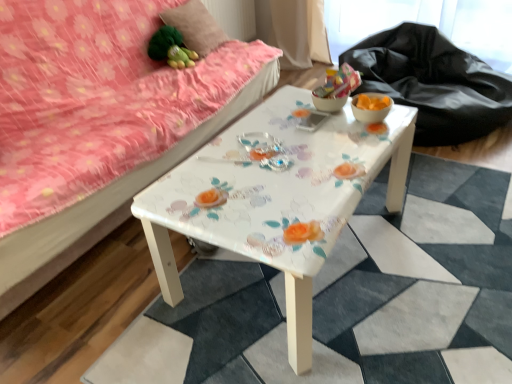
Question: Is matte orange glass bowl at right, which is the 1th glass bowl from right to left, completely or partially outside of fluffy pink pillow at upper left?

Choices:
 (A) no
 (B) yes

Answer: (B)

Question: From a real-world perspective, is matte orange glass bowl at right, the second glass bowl viewed from the left, below fluffy pink pillow at upper left?

Choices:
 (A) yes
 (B) no

Answer: (A)

Question: Is matte orange glass bowl at right, the second glass bowl viewed from the left, bigger than fluffy pink pillow at upper left?

Choices:
 (A) yes
 (B) no

Answer: (B)

Question: Does matte orange glass bowl at right, which is the 1th glass bowl from right to left, appear on the right side of fluffy pink pillow at upper left?

Choices:
 (A) no
 (B) yes

Answer: (B)

Question: Considering the relative positions of matte orange glass bowl at right, the second glass bowl viewed from the left, and fluffy pink pillow at upper left in the image provided, is matte orange glass bowl at right, the second glass bowl viewed from the left, to the left of fluffy pink pillow at upper left from the viewer's perspective?

Choices:
 (A) no
 (B) yes

Answer: (A)

Question: Looking at the image, does matte orange glass bowl at right, which is the 1th glass bowl from right to left, seem bigger or smaller compared to white glossy table at center?

Choices:
 (A) small
 (B) big

Answer: (A)

Question: In the image, is matte orange glass bowl at right, which is the 1th glass bowl from right to left, positioned in front of or behind white glossy table at center?

Choices:
 (A) front
 (B) behind

Answer: (B)

Question: From a real-world perspective, is matte orange glass bowl at right, the second glass bowl viewed from the left, physically located above or below white glossy table at center?

Choices:
 (A) below
 (B) above

Answer: (B)

Question: Which is correct: matte orange glass bowl at right, which is the 1th glass bowl from right to left, is inside white glossy table at center, or outside of it?

Choices:
 (A) inside
 (B) outside

Answer: (B)

Question: Looking at their shapes, would you say black fabric at upper right is wider or thinner than green fabric toy at upper left?

Choices:
 (A) thin
 (B) wide

Answer: (B)

Question: From a real-world perspective, is black fabric at upper right above or below green fabric toy at upper left?

Choices:
 (A) below
 (B) above

Answer: (A)

Question: From the image's perspective, relative to green fabric toy at upper left, is black fabric at upper right above or below?

Choices:
 (A) below
 (B) above

Answer: (A)

Question: Choose the correct answer: Is black fabric at upper right inside green fabric toy at upper left or outside it?

Choices:
 (A) outside
 (B) inside

Answer: (A)

Question: In terms of width, does matte orange glass bowl at right, which is the 1th glass bowl from right to left, look wider or thinner when compared to fluffy pink pillow at upper left?

Choices:
 (A) thin
 (B) wide

Answer: (A)

Question: From their relative heights in the image, would you say matte orange glass bowl at right, which is the 1th glass bowl from right to left, is taller or shorter than fluffy pink pillow at upper left?

Choices:
 (A) short
 (B) tall

Answer: (A)